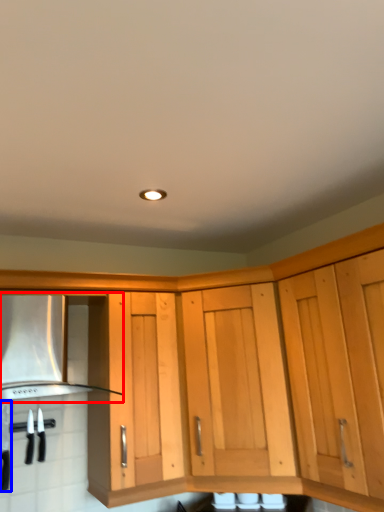
Question: Which object is closer to the camera taking this photo, vent (highlighted by a red box) or kitchen appliance (highlighted by a blue box)?

Choices:
 (A) vent
 (B) kitchen appliance

Answer: (A)